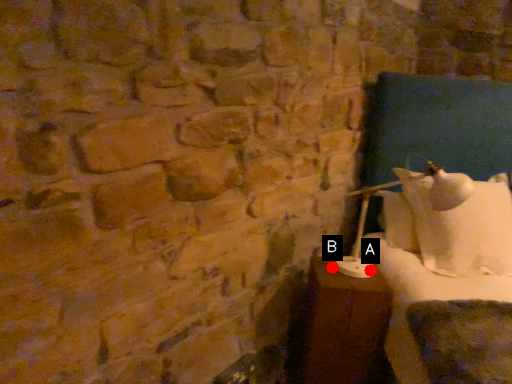
Question: Two points are circled on the image, labeled by A and B beside each circle. Which point is further to the camera?

Choices:
 (A) A is further
 (B) B is further

Answer: (B)